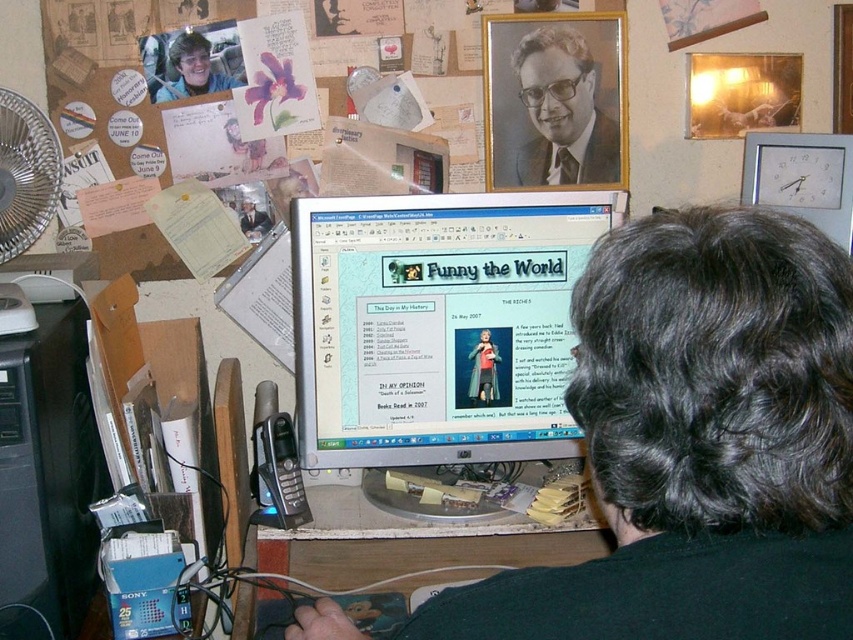
Question: Based on their relative distances, which object is nearer to the silver metallic computer monitor at center?

Choices:
 (A) matte black laptop at center
 (B) formal black suit at upper center
 (C) matte black hair at upper center

Answer: (B)

Question: Does formal black suit at upper center have a greater width compared to matte black laptop at center?

Choices:
 (A) no
 (B) yes

Answer: (B)

Question: Which object appears closest to the camera in this image?

Choices:
 (A) silver metallic computer monitor at center
 (B) matte black hair at upper center

Answer: (A)

Question: Is white plastic clock at upper right closer to the viewer compared to brushed metal fan at left?

Choices:
 (A) no
 (B) yes

Answer: (A)

Question: Among these points, which one is nearest to the camera?

Choices:
 (A) (67, 500)
 (B) (28, 122)

Answer: (A)

Question: Is black plastic desktop computer at left wider than matte black hair at upper center?

Choices:
 (A) no
 (B) yes

Answer: (A)